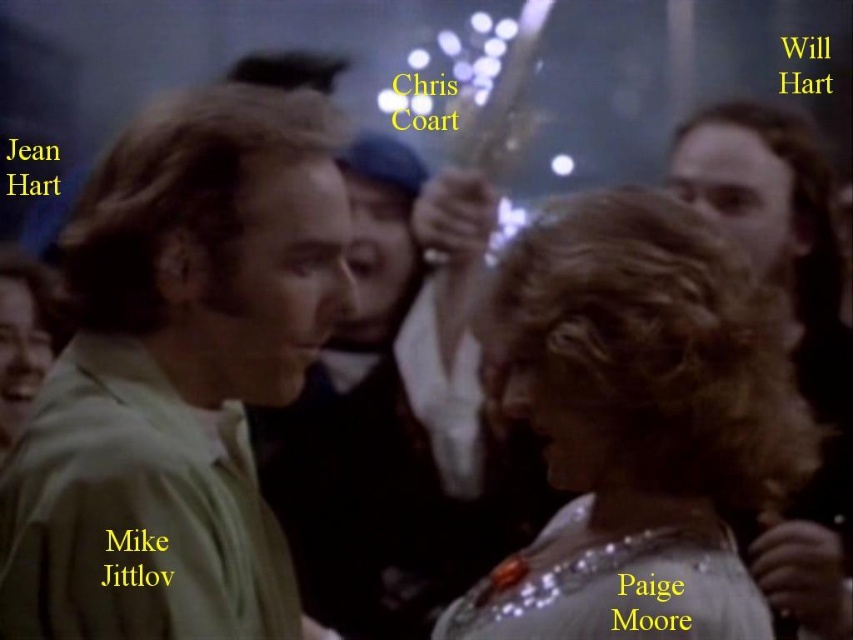
Question: Is smooth black shirt at center smaller than dark brown hair at right?

Choices:
 (A) no
 (B) yes

Answer: (B)

Question: Is green matte shirt at left bigger than smooth black shirt at center?

Choices:
 (A) no
 (B) yes

Answer: (A)

Question: Is green matte shirt at left above satin silver dress at center?

Choices:
 (A) no
 (B) yes

Answer: (B)

Question: Which point is closer to the camera?

Choices:
 (A) dark brown hair at right
 (B) smooth black shirt at center
 (C) satin silver dress at center
 (D) green matte shirt at left

Answer: (D)

Question: Which is nearer to the green matte shirt at left?

Choices:
 (A) smooth black shirt at center
 (B) dark brown hair at right

Answer: (A)

Question: Among these objects, which one is nearest to the camera?

Choices:
 (A) green matte shirt at left
 (B) satin silver dress at center

Answer: (A)